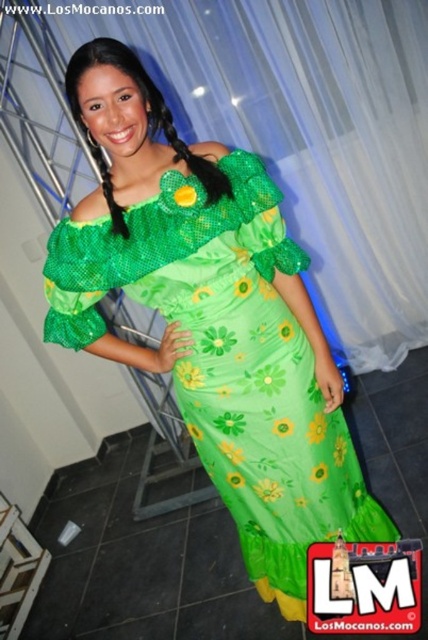
Question: Where is translucent white curtain at upper center located in relation to green satin dress at center in the image?

Choices:
 (A) below
 (B) above

Answer: (B)

Question: Is translucent white curtain at upper center to the right of green satin dress at center from the viewer's perspective?

Choices:
 (A) yes
 (B) no

Answer: (A)

Question: Observing the image, what is the correct spatial positioning of translucent white curtain at upper center in reference to green satin dress at center?

Choices:
 (A) below
 (B) above

Answer: (B)

Question: Which point is closer to the camera?

Choices:
 (A) translucent white curtain at upper center
 (B) green satin dress at center

Answer: (B)

Question: Which point is closer to the camera?

Choices:
 (A) translucent white curtain at upper center
 (B) green satin dress at center

Answer: (B)

Question: Which of the following is the farthest from the observer?

Choices:
 (A) (3, 99)
 (B) (228, 330)

Answer: (A)